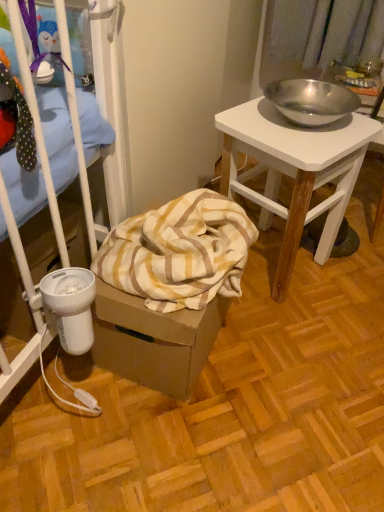
Question: Visually, is yellow striped fabric at lower left positioned to the left or to the right of polished metal bowl at upper right?

Choices:
 (A) right
 (B) left

Answer: (B)

Question: In terms of height, does yellow striped fabric at lower left look taller or shorter compared to polished metal bowl at upper right?

Choices:
 (A) tall
 (B) short

Answer: (B)

Question: Is yellow striped fabric at lower left inside the boundaries of polished metal bowl at upper right, or outside?

Choices:
 (A) outside
 (B) inside

Answer: (A)

Question: Based on their sizes in the image, would you say polished metal bowl at upper right is bigger or smaller than yellow striped fabric at lower left?

Choices:
 (A) big
 (B) small

Answer: (A)

Question: Considering their positions, is polished metal bowl at upper right located in front of or behind yellow striped fabric at lower left?

Choices:
 (A) front
 (B) behind

Answer: (B)

Question: From a real-world perspective, relative to yellow striped fabric at lower left, is polished metal bowl at upper right vertically above or below?

Choices:
 (A) below
 (B) above

Answer: (A)

Question: Is polished metal bowl at upper right spatially inside yellow striped fabric at lower left, or outside of it?

Choices:
 (A) outside
 (B) inside

Answer: (A)